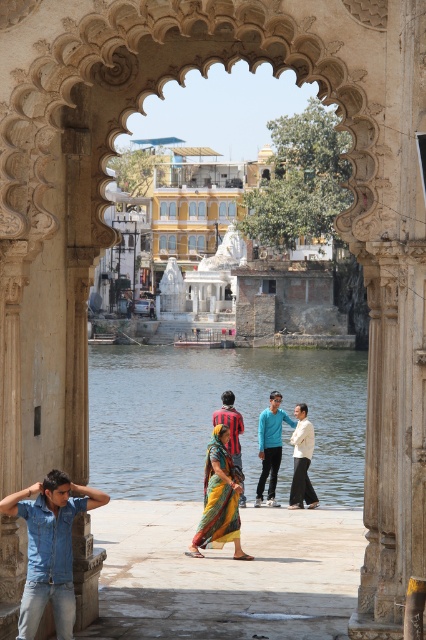
Which is behind, point (230, 218) or point (204, 476)?

The point (230, 218) is more distant.

Can you confirm if white marble palace at center is bigger than yellow silk saree at center?

Yes.

Is point (206, 234) positioned after point (239, 552)?

Yes, it is behind point (239, 552).

This screenshot has height=640, width=426. In order to click on white marble palace at center in this screenshot , I will do `click(187, 196)`.

Between yellow silk saree at center and vivid yellow sari at center, which one appears on the left side from the viewer's perspective?

Positioned to the left is yellow silk saree at center.

Is point (236, 493) closer to viewer compared to point (232, 426)?

Yes, it is in front of point (232, 426).

This screenshot has width=426, height=640. What are the coordinates of `yellow silk saree at center` in the screenshot? It's located at (218, 499).

Between denim shirt at lower left and white cotton dress at center, which one has less height?

With less height is denim shirt at lower left.

Does denim shirt at lower left appear under white cotton dress at center?

Actually, denim shirt at lower left is above white cotton dress at center.

Between point (26, 611) and point (302, 449), which one is positioned in front?

Positioned in front is point (26, 611).

At what (x,y) coordinates should I click in order to perform the action: click on denim shirt at lower left. Please return your answer as a coordinate pair (x, y). The height and width of the screenshot is (640, 426). Looking at the image, I should click on (49, 548).